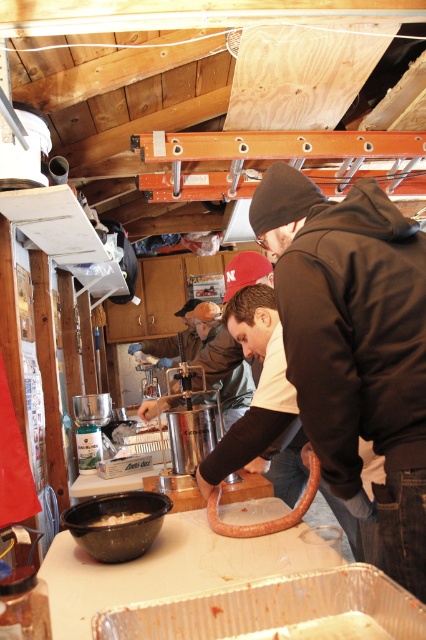
Question: Is black matte jacket at center wider than white matte bowl at lower left?

Choices:
 (A) no
 (B) yes

Answer: (B)

Question: Considering the relative positions of black matte jacket at center and white matte bowl at lower left in the image provided, where is black matte jacket at center located with respect to white matte bowl at lower left?

Choices:
 (A) below
 (B) above

Answer: (B)

Question: Which object is closer to the camera taking this photo?

Choices:
 (A) black matte jacket at center
 (B) white matte bowl at lower left

Answer: (A)

Question: Can you confirm if black matte jacket at center is thinner than white matte bowl at lower left?

Choices:
 (A) no
 (B) yes

Answer: (A)